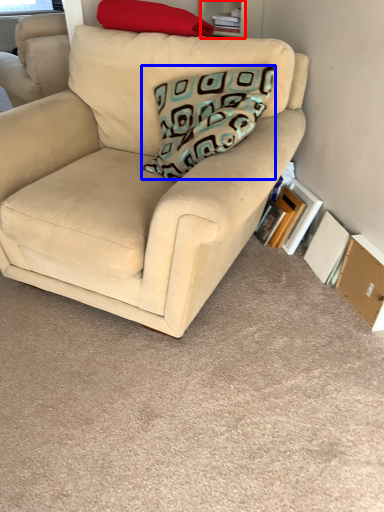
Question: Which object appears closest to the camera in this image, shelf (highlighted by a red box) or pillow (highlighted by a blue box)?

Choices:
 (A) shelf
 (B) pillow

Answer: (B)